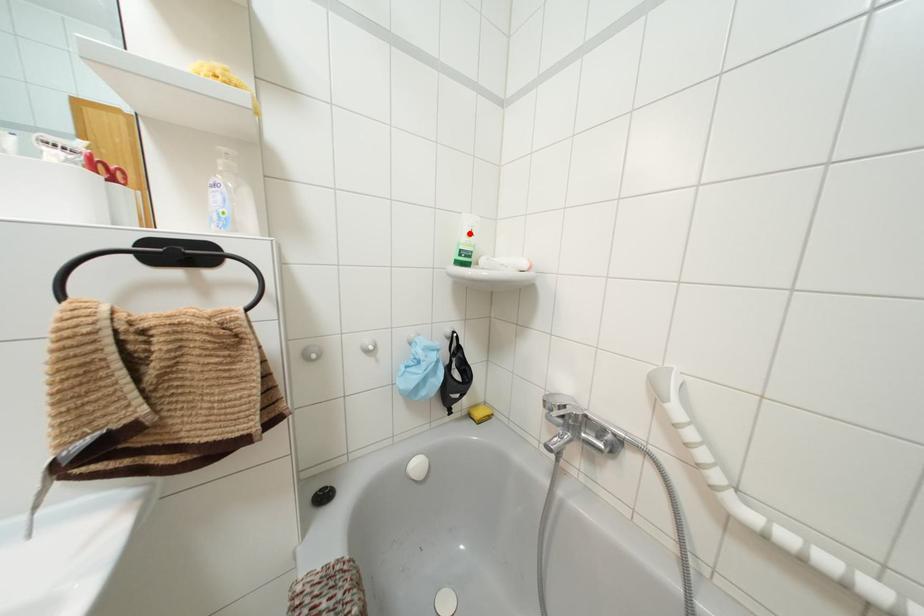
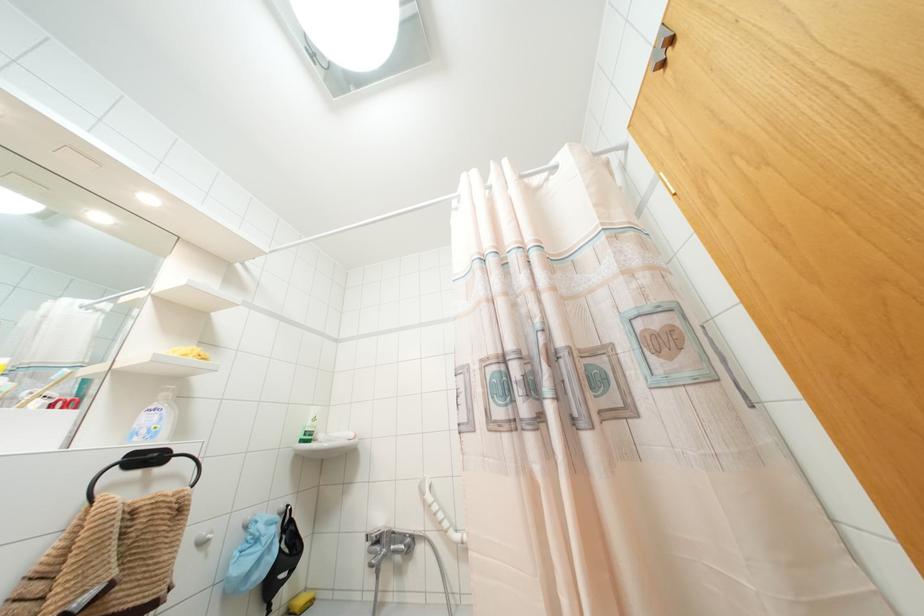
Question: I am providing you with two images of the same scene from different viewpoints. A red point is marked on the first image. At the location where the point appears in image 1, is it still visible in image 2?

Choices:
 (A) Yes
 (B) No

Answer: (A)